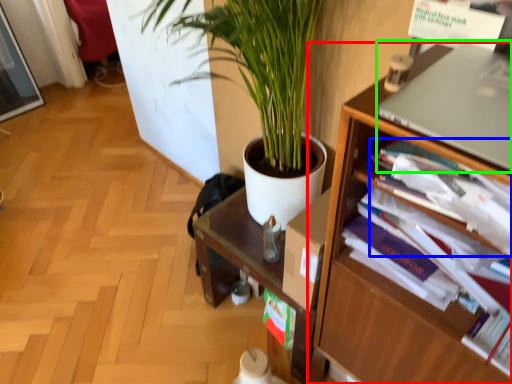
Question: Which object is positioned farthest from shelf (highlighted by a red box)? Select from magazine (highlighted by a blue box) and computer (highlighted by a green box).

Choices:
 (A) magazine
 (B) computer

Answer: (B)